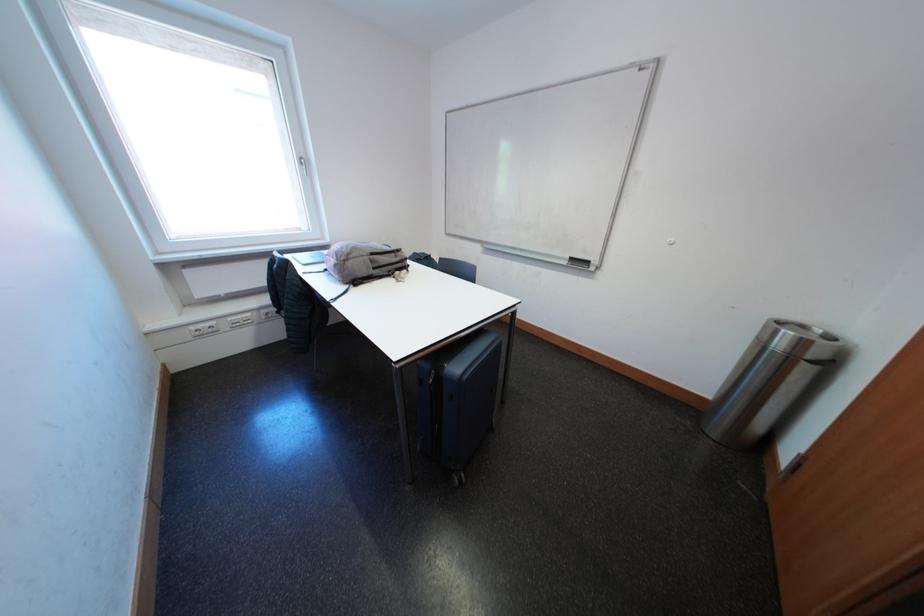
Locate an element on the screen. This screenshot has height=616, width=924. suitcase handle is located at coordinates (465, 342).